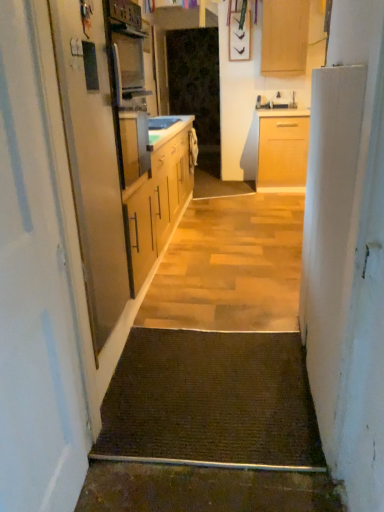
Question: Is light wood cabinet at upper center not inside white glossy sink at center?

Choices:
 (A) no
 (B) yes

Answer: (B)

Question: Does light wood cabinet at upper center contain white glossy sink at center?

Choices:
 (A) no
 (B) yes

Answer: (A)

Question: Can you confirm if light wood cabinet at upper center is bigger than white glossy sink at center?

Choices:
 (A) yes
 (B) no

Answer: (A)

Question: From a real-world perspective, is light wood cabinet at upper center positioned over white glossy sink at center based on gravity?

Choices:
 (A) no
 (B) yes

Answer: (B)

Question: Is light wood cabinet at upper center oriented away from white glossy sink at center?

Choices:
 (A) no
 (B) yes

Answer: (A)

Question: From a real-world perspective, is white glossy sink at center positioned above or below brown textured mat at center?

Choices:
 (A) above
 (B) below

Answer: (A)

Question: Relative to brown textured mat at center, is white glossy sink at center in front or behind?

Choices:
 (A) front
 (B) behind

Answer: (B)

Question: Looking at the image, does white glossy sink at center seem bigger or smaller compared to brown textured mat at center?

Choices:
 (A) small
 (B) big

Answer: (A)

Question: In the image, is white glossy sink at center on the left side or the right side of brown textured mat at center?

Choices:
 (A) left
 (B) right

Answer: (A)

Question: Is transparent plastic screen door at center, the 2th screen door positioned from the left, in front of or behind brown textured mat at center in the image?

Choices:
 (A) behind
 (B) front

Answer: (A)

Question: Is transparent plastic screen door at center, the 2th screen door positioned from the left, situated inside brown textured mat at center or outside?

Choices:
 (A) outside
 (B) inside

Answer: (A)

Question: From the image's perspective, is transparent plastic screen door at center, the 1th screen door viewed from the right, above or below brown textured mat at center?

Choices:
 (A) below
 (B) above

Answer: (B)

Question: From a real-world perspective, relative to brown textured mat at center, is transparent plastic screen door at center, the 1th screen door positioned from the top, vertically above or below?

Choices:
 (A) below
 (B) above

Answer: (B)

Question: Relative to white glossy sink at center, is light wood cabinet at upper center in front or behind?

Choices:
 (A) behind
 (B) front

Answer: (A)

Question: Would you say light wood cabinet at upper center is to the left or to the right of white glossy sink at center in the picture?

Choices:
 (A) left
 (B) right

Answer: (B)